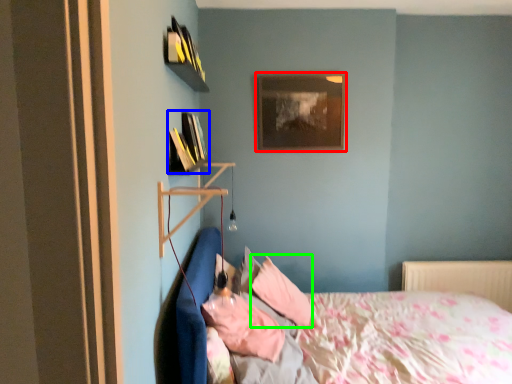
Question: Considering the real-world distances, which object is farthest from picture frame (highlighted by a red box)? book (highlighted by a blue box) or pillow (highlighted by a green box)?

Choices:
 (A) book
 (B) pillow

Answer: (B)